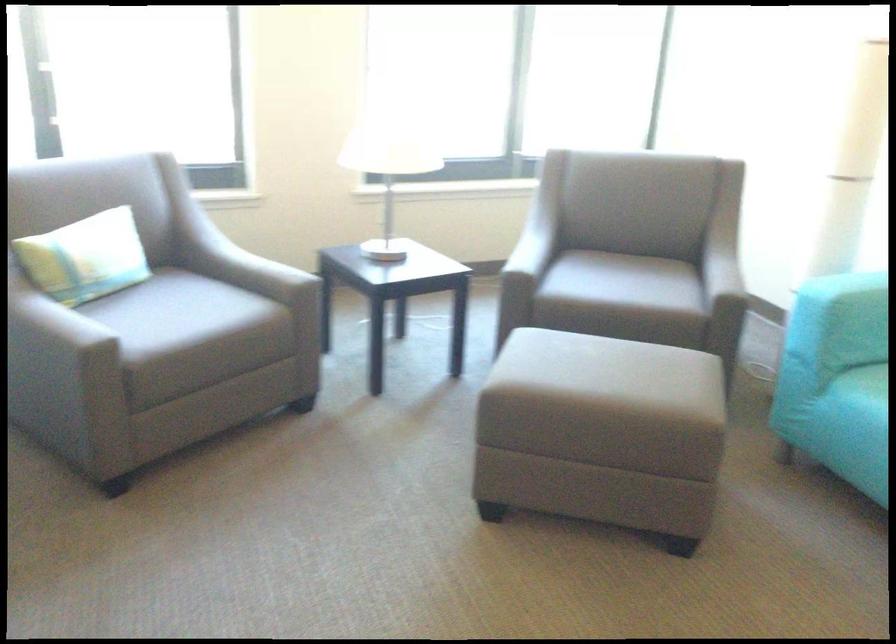
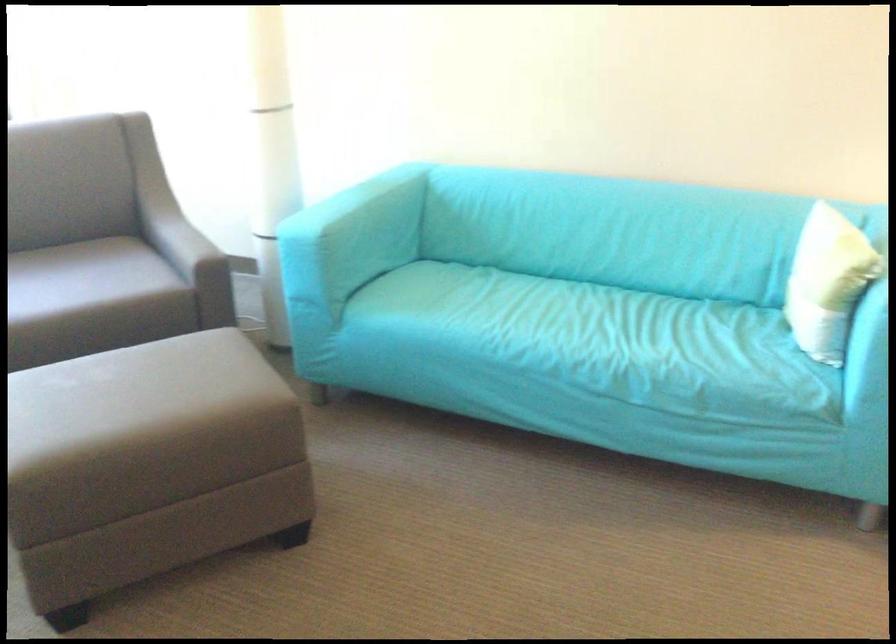
Question: The camera is either moving clockwise (left) or counter-clockwise (right) around the object. The first image is from the beginning of the video and the second image is from the end. Is the camera moving left or right when shooting the video?

Choices:
 (A) Left
 (B) Right

Answer: (A)